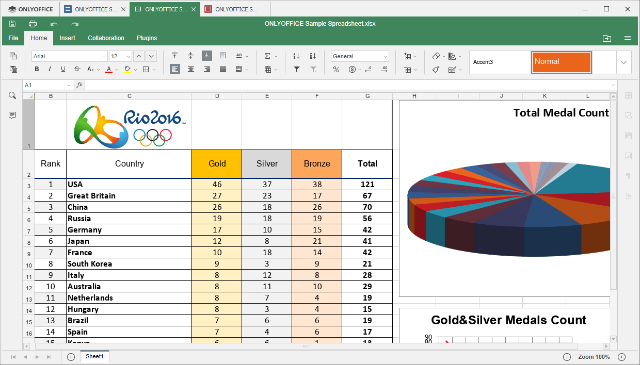
Where is `columns`? This screenshot has height=365, width=640. columns is located at coordinates (58, 164), (116, 166), (208, 166), (266, 166), (315, 161), (356, 156).